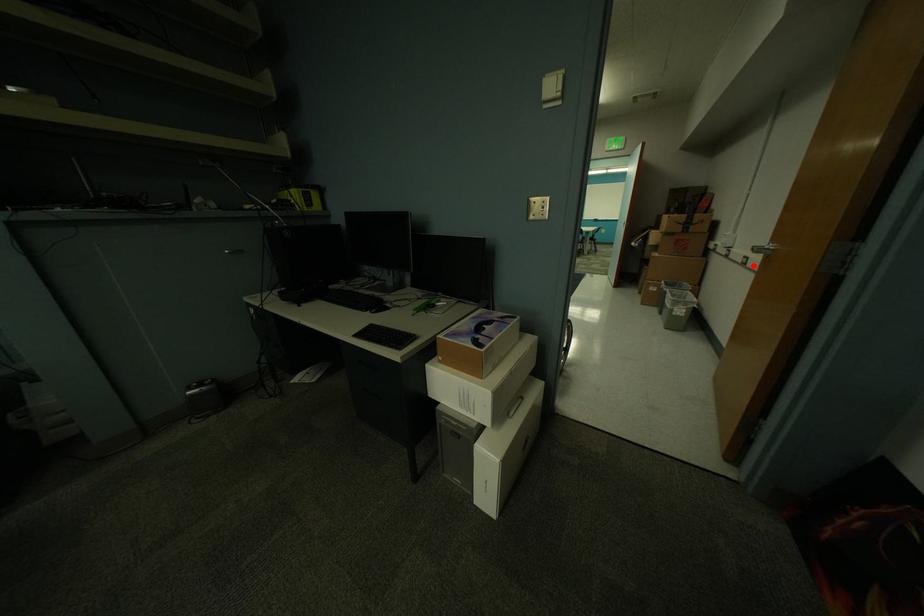
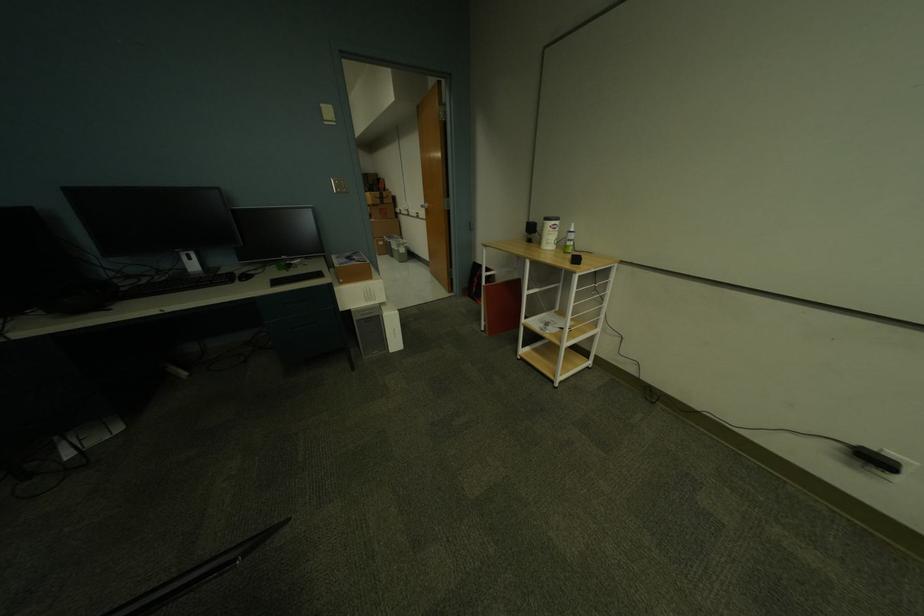
Question: A red point is marked in image1. In image2, is the corresponding 3D point closer to the camera or farther? Reply with the corresponding letter.

Choices:
 (A) The corresponding 3D point is closer.
 (B) The corresponding 3D point is farther.

Answer: (A)